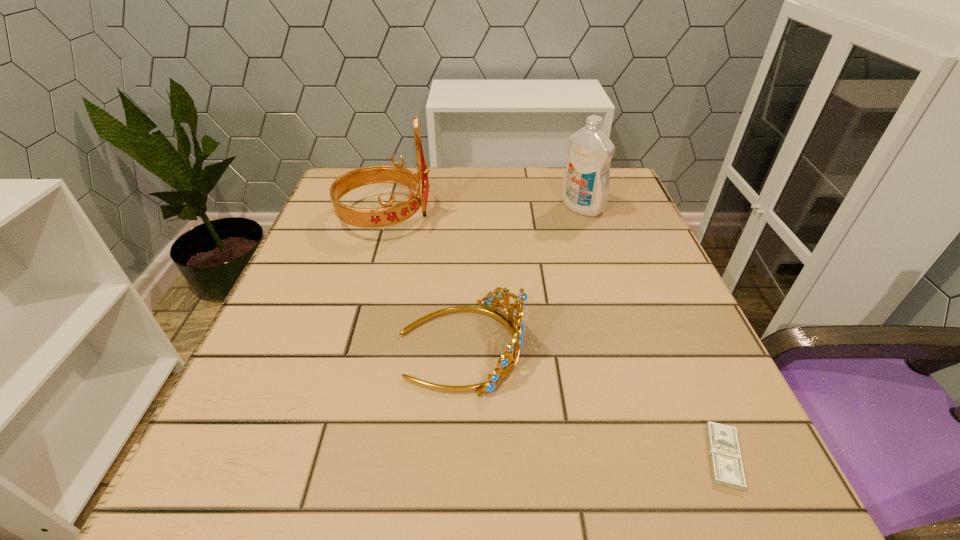
Identify the location of free space between the third farthest object and the shortest object. (592, 401).

The image size is (960, 540). What are the coordinates of `unoccupied area between the nearest object and the taller tiara` in the screenshot? It's located at (555, 336).

Identify the location of free space between the farther tiara and the shorter tiara. This screenshot has height=540, width=960. coord(423,281).

What are the coordinates of `free space between the second object from right to left and the nearest object` in the screenshot? It's located at (653, 332).

The height and width of the screenshot is (540, 960). In order to click on the second closest object to the money in this screenshot , I will do `click(585, 189)`.

This screenshot has height=540, width=960. What are the coordinates of `object that is the closest to the detergent` in the screenshot? It's located at (389, 214).

At what (x,y) coordinates should I click in order to perform the action: click on vacant space that satisfies the following two spatial constraints: 1. on the front-facing side of the nearest object; 2. on the left side of the farther tiara. Please return your answer as a coordinate pair (x, y). The image size is (960, 540). Looking at the image, I should click on (317, 456).

Locate an element on the screen. This screenshot has height=540, width=960. vacant point that satisfies the following two spatial constraints: 1. on the front side of the detergent; 2. on the right side of the money is located at coordinates (662, 456).

The height and width of the screenshot is (540, 960). In order to click on free spot that satisfies the following two spatial constraints: 1. on the front-facing side of the money; 2. on the right side of the third tallest object in this screenshot , I will do `click(456, 456)`.